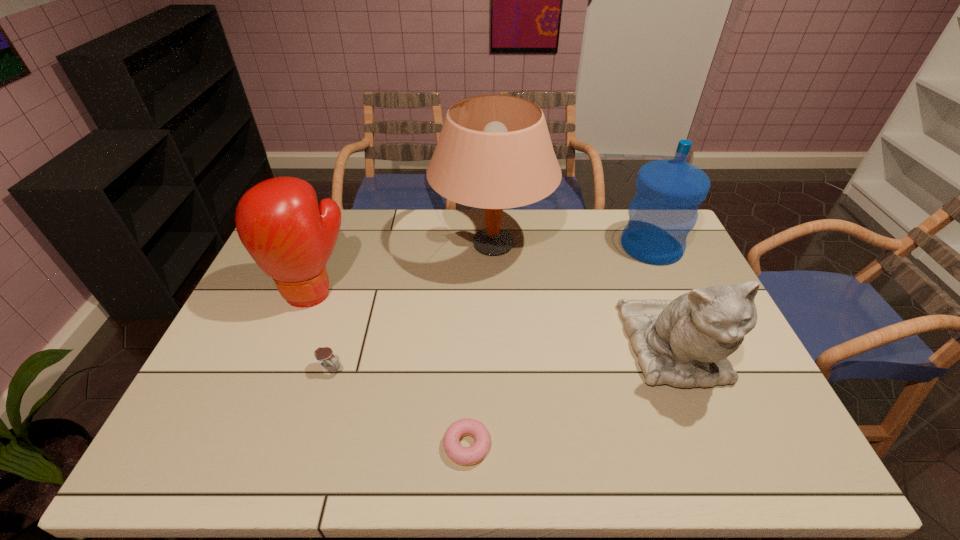
Where is `lampshade`? Image resolution: width=960 pixels, height=540 pixels. lampshade is located at coordinates (494, 151).

This screenshot has height=540, width=960. I want to click on water jug, so click(x=663, y=211).

Locate an element on the screen. The image size is (960, 540). boxing glove is located at coordinates (291, 238).

Identify the location of cat. (685, 342).

At what (x,y) coordinates should I click in order to perform the action: click on the fifth tallest object. Please return your answer as a coordinate pair (x, y). Looking at the image, I should click on point(322,354).

At what (x,y) coordinates should I click in order to perform the action: click on the nearest object. Please return your answer as a coordinate pair (x, y). This screenshot has width=960, height=540. Looking at the image, I should click on (455, 451).

Identify the location of the shortest object. (455, 451).

The height and width of the screenshot is (540, 960). I want to click on free location located 0.090m on the front-facing side of the tallest object, so click(408, 244).

Locate an element on the screen. vacant space located on the front-facing side of the tallest object is located at coordinates (379, 244).

Where is `vacant space located on the front-facing side of the tallest object`? vacant space located on the front-facing side of the tallest object is located at coordinates (325, 244).